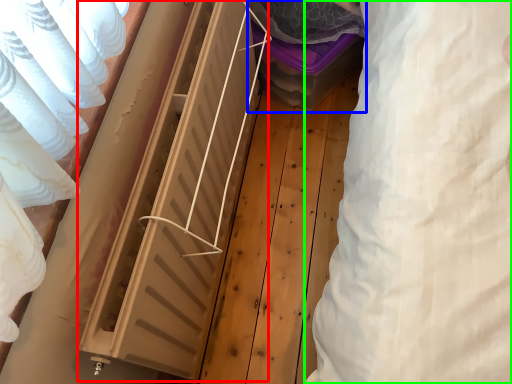
Question: Based on their relative distances, which object is nearer to radiator (highlighted by a red box)? Choose from storage box (highlighted by a blue box) and clothing (highlighted by a green box).

Choices:
 (A) storage box
 (B) clothing

Answer: (A)